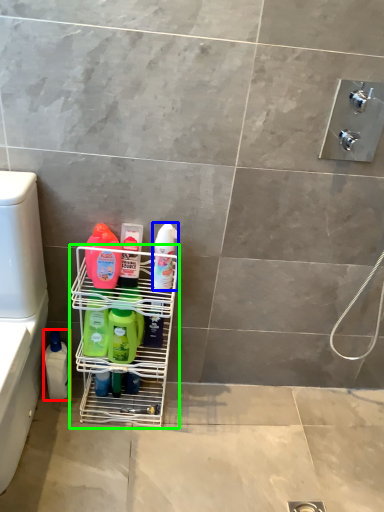
Question: Which object is the farthest from cleaning product (highlighted by a red box)? Choose among these: cleaning product (highlighted by a blue box) or shelf (highlighted by a green box).

Choices:
 (A) cleaning product
 (B) shelf

Answer: (A)